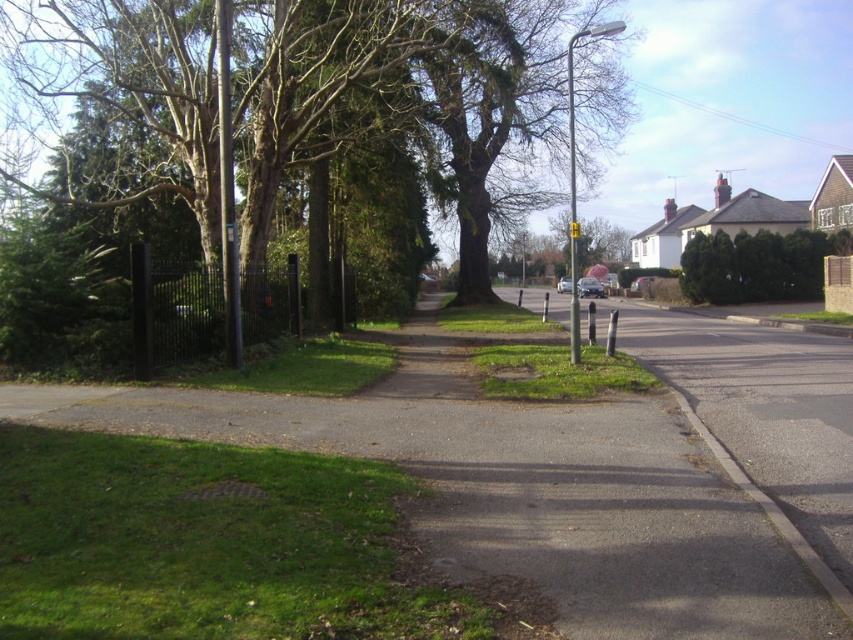
Based on the photo, you are standing at the point with coordinates point (567, 627) and want to walk towards the point (833, 253). Based on the scene description, will you have to go around any obstacles along the way?

Point (567, 627) is in front of point (833, 253), so you will not have to go around any obstacles because the path is clear between them.

You are a bird looking for a place to perch. You see two trees in the image, the green leafy tree at center and the green leafy tree at upper right. Which tree is located above the other?

The green leafy tree at center is positioned over the green leafy tree at upper right, so the green leafy tree at center is above the other one.